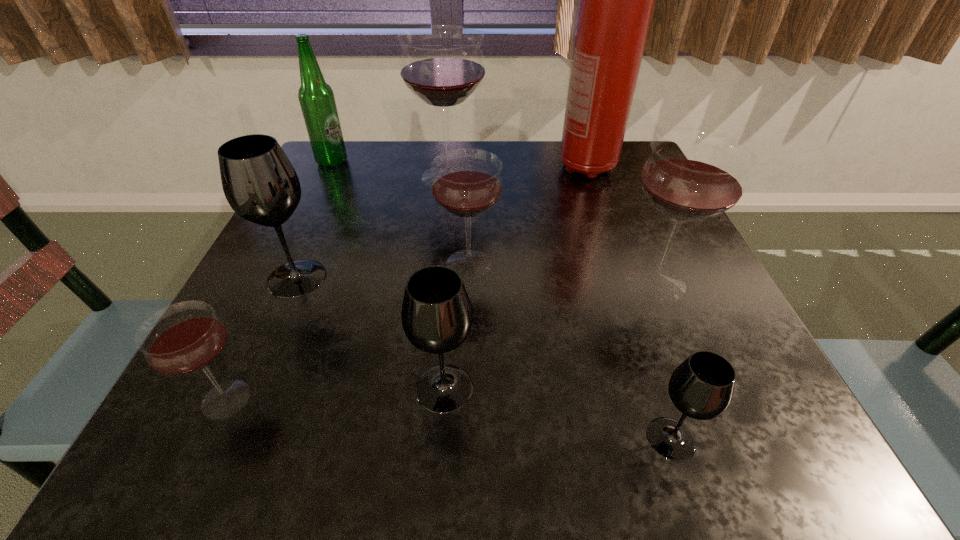
At what (x,y) coordinates should I click in order to perform the action: click on object positioned at the near left corner. Please return your answer as a coordinate pair (x, y). This screenshot has width=960, height=540. Looking at the image, I should click on (184, 338).

This screenshot has width=960, height=540. I want to click on object located in the far right corner section of the desktop, so click(x=616, y=4).

You are a GUI agent. You are given a task and a screenshot of the screen. Output one action in this format:
    pyautogui.click(x=<x>, y=<y>)
    Task: Click on the object present at the near right corner
    This screenshot has height=540, width=960.
    Given the screenshot: What is the action you would take?
    pyautogui.click(x=701, y=387)

The image size is (960, 540). In the image, there is a desktop. Identify the location of free space at the far edge. (396, 159).

You are a GUI agent. You are given a task and a screenshot of the screen. Output one action in this format:
    pyautogui.click(x=<x>, y=<y>)
    Task: Click on the free space at the near edge of the desktop
    This screenshot has width=960, height=540.
    Given the screenshot: What is the action you would take?
    pyautogui.click(x=361, y=468)

Find the location of a particular element. vacant area at the left edge is located at coordinates (263, 271).

This screenshot has width=960, height=540. I want to click on vacant space at the right edge, so click(678, 357).

The width and height of the screenshot is (960, 540). Find the location of `free location at the far left corner of the desktop`. free location at the far left corner of the desktop is located at coordinates (335, 171).

Locate an element on the screen. vacant space at the near left corner is located at coordinates (229, 427).

The width and height of the screenshot is (960, 540). In the image, there is a desktop. Find the location of `vacant space at the far right corner`. vacant space at the far right corner is located at coordinates (608, 189).